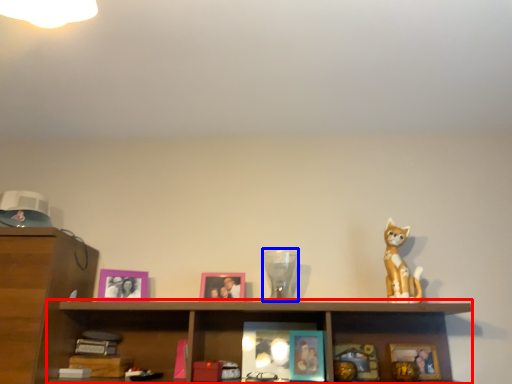
Question: Which object is further to the camera taking this photo, cabinet (highlighted by a red box) or glass vase (highlighted by a blue box)?

Choices:
 (A) cabinet
 (B) glass vase

Answer: (B)